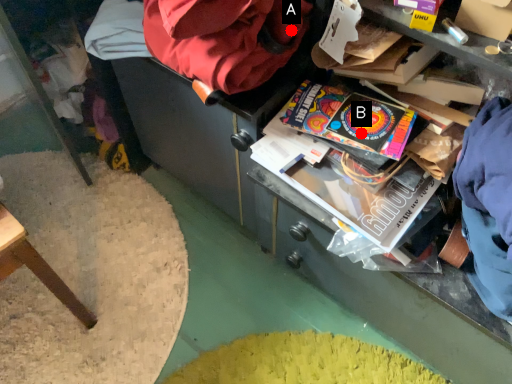
Question: Two points are circled on the image, labeled by A and B beside each circle. Among these points, which one is farthest from the camera?

Choices:
 (A) A is further
 (B) B is further

Answer: (A)